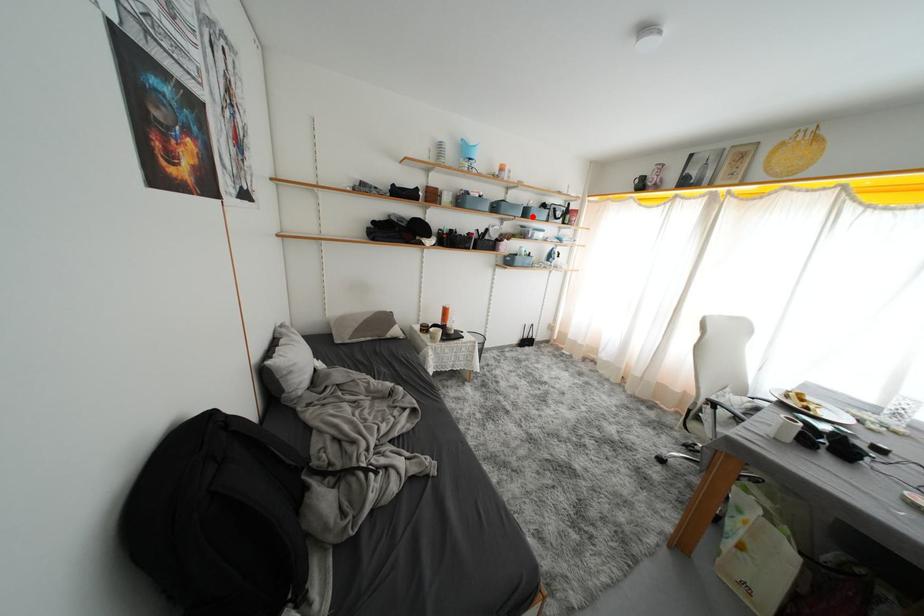
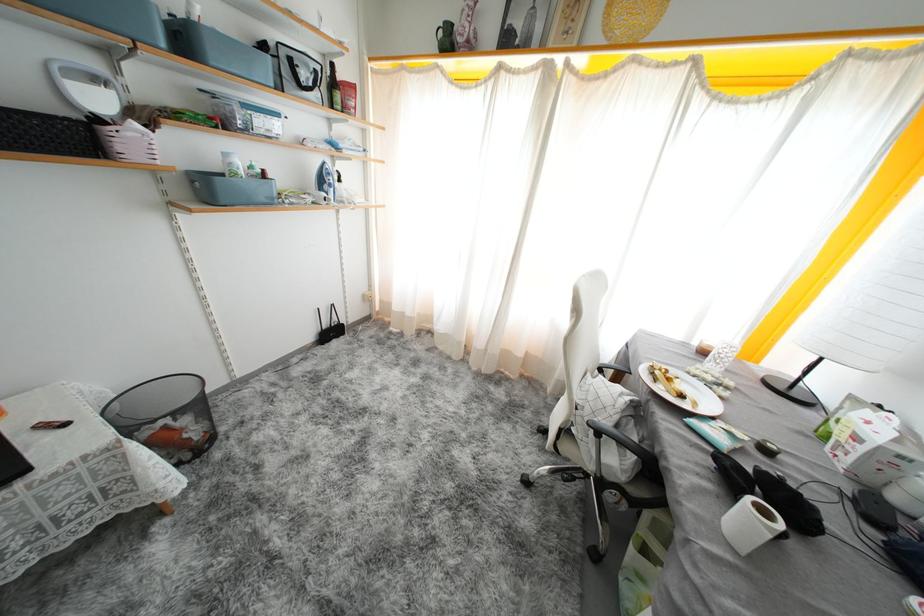
In the second image, find the point that corresponds to the highlighted location in the first image.

(190, 44)